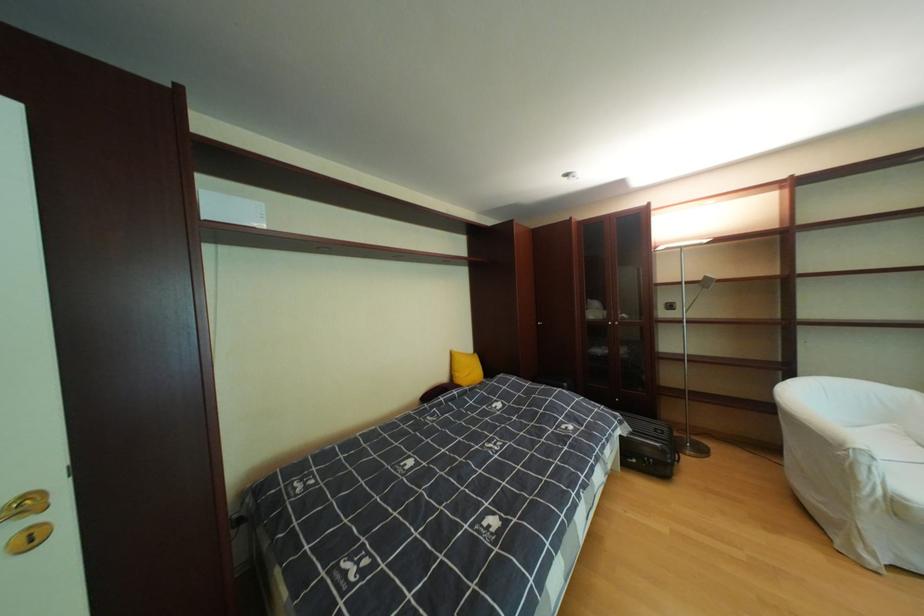
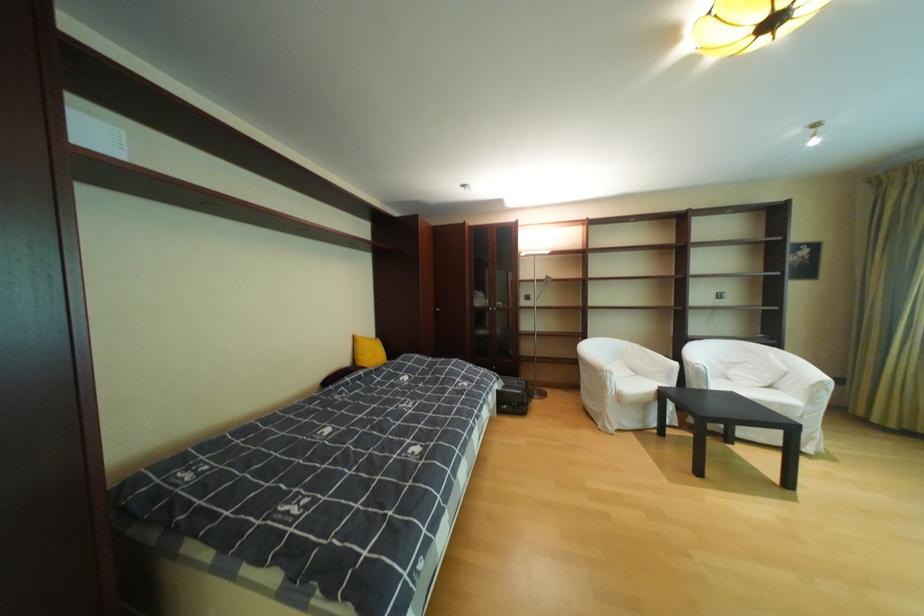
In the second image, find the point that corresponds to (x=661, y=461) in the first image.

(526, 405)